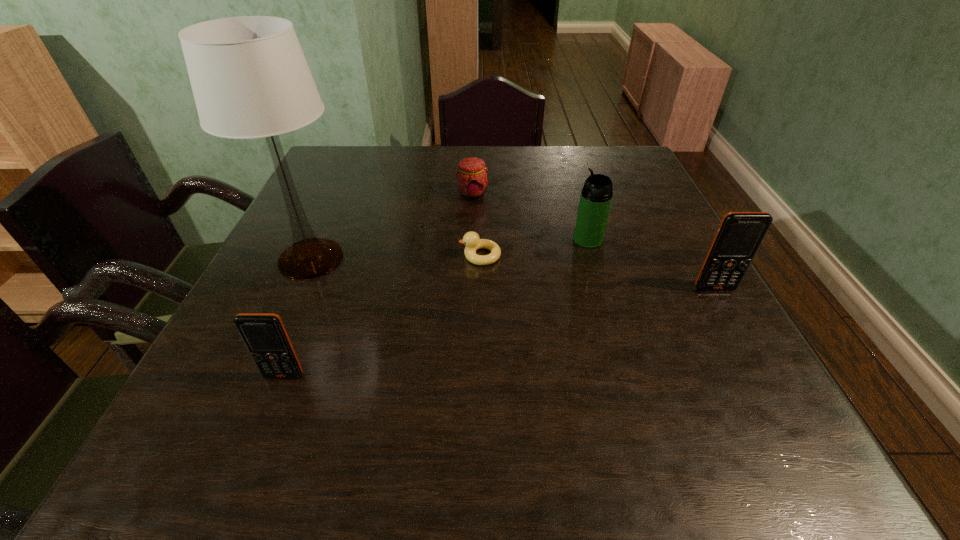
In order to click on the fourth tallest object in this screenshot , I will do `click(264, 334)`.

Locate an element on the screen. The width and height of the screenshot is (960, 540). the nearest object is located at coordinates (264, 334).

The width and height of the screenshot is (960, 540). I want to click on the farther cellular telephone, so click(739, 235).

At what (x,y) coordinates should I click in order to perform the action: click on the rightmost object. Please return your answer as a coordinate pair (x, y). The width and height of the screenshot is (960, 540). Looking at the image, I should click on click(739, 235).

Identify the location of the tallest object. This screenshot has height=540, width=960. click(250, 79).

You are a GUI agent. You are given a task and a screenshot of the screen. Output one action in this format:
    pyautogui.click(x=<x>, y=<y>)
    Task: Click on the thermos bottle
    The height and width of the screenshot is (540, 960).
    Given the screenshot: What is the action you would take?
    pyautogui.click(x=596, y=196)

You are a GUI agent. You are given a task and a screenshot of the screen. Output one action in this format:
    pyautogui.click(x=<x>, y=<y>)
    Task: Click on the jam
    
    Given the screenshot: What is the action you would take?
    pyautogui.click(x=472, y=182)

Locate an element on the screen. This screenshot has width=960, height=540. the farthest object is located at coordinates (472, 182).

Find the location of `duckling`. duckling is located at coordinates (471, 239).

Locate an element on the screen. This screenshot has height=540, width=960. vacant space situated 0.120m on the screen of the taller cellular telephone is located at coordinates (742, 338).